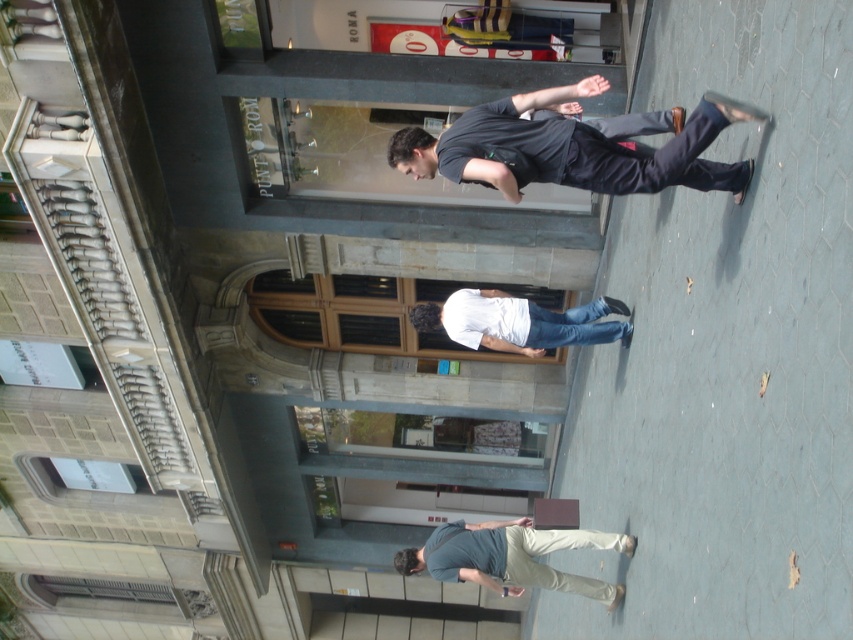
Question: Which of these objects is positioned farthest from the dark blue jeans at center?

Choices:
 (A) white matte shirt at center
 (B) gray cotton shirt at lower center

Answer: (B)

Question: Based on their relative distances, which object is nearer to the dark blue jeans at center?

Choices:
 (A) white matte shirt at center
 (B) gray cotton shirt at lower center

Answer: (A)

Question: Does dark blue jeans at center come behind gray cotton shirt at lower center?

Choices:
 (A) yes
 (B) no

Answer: (B)

Question: Which of the following is the farthest from the observer?

Choices:
 (A) white matte shirt at center
 (B) gray cotton shirt at lower center
 (C) dark blue jeans at center

Answer: (A)

Question: Can you confirm if dark blue jeans at center is smaller than gray cotton shirt at lower center?

Choices:
 (A) yes
 (B) no

Answer: (B)

Question: Is dark blue jeans at center bigger than gray cotton shirt at lower center?

Choices:
 (A) yes
 (B) no

Answer: (A)